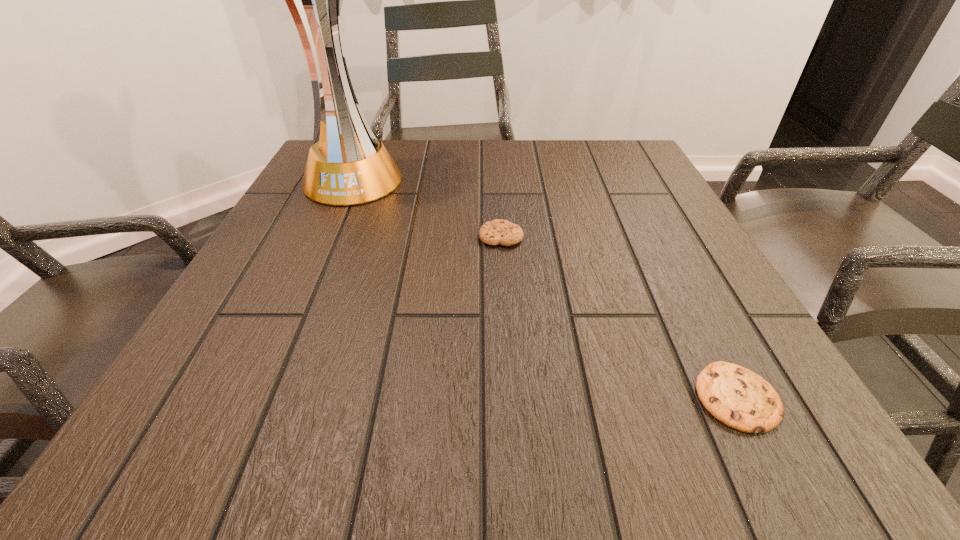
Locate an element on the screen. free spot between the left cookie and the tallest object is located at coordinates (426, 208).

The width and height of the screenshot is (960, 540). Identify the location of free point between the left cookie and the farthest object. (426, 208).

The height and width of the screenshot is (540, 960). Find the location of `free spot between the leftmost object and the nearer cookie`. free spot between the leftmost object and the nearer cookie is located at coordinates [544, 288].

You are a GUI agent. You are given a task and a screenshot of the screen. Output one action in this format:
    pyautogui.click(x=<x>, y=<y>)
    Task: Click on the vacant region between the second farthest object and the farthest object
    
    Given the screenshot: What is the action you would take?
    pyautogui.click(x=426, y=208)

In order to click on empty location between the taller cookie and the leftmost object in this screenshot , I will do `click(426, 208)`.

Find the location of a particular element. free space between the leftmost object and the nearest object is located at coordinates (544, 288).

The image size is (960, 540). In order to click on unoccupied position between the nearer cookie and the tallest object in this screenshot , I will do `click(544, 288)`.

This screenshot has width=960, height=540. In order to click on free space between the farther cookie and the farthest object in this screenshot , I will do `click(426, 208)`.

This screenshot has width=960, height=540. What are the coordinates of `empty location between the trophy and the second shortest object` in the screenshot? It's located at (426, 208).

Locate an element on the screen. blank region between the leftmost object and the nearer cookie is located at coordinates (544, 288).